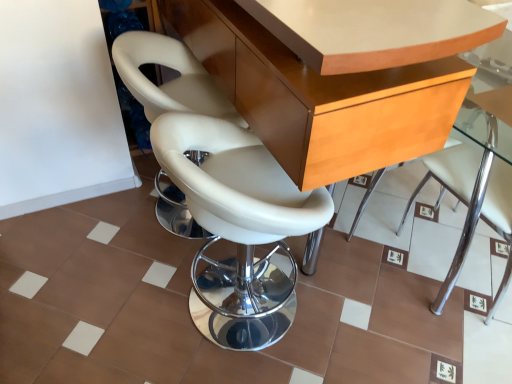
Question: Is white leather chair at center, which ranks as the 3th chair in left-to-right order, not within white leather chair at center, the 2th chair in the left-to-right sequence?

Choices:
 (A) yes
 (B) no

Answer: (A)

Question: From a real-world perspective, is white leather chair at center, which ranks as the 1th chair in right-to-left order, on top of white leather chair at center, the 2th chair in the left-to-right sequence?

Choices:
 (A) no
 (B) yes

Answer: (B)

Question: Does white leather chair at center, which ranks as the 1th chair in right-to-left order, have a lesser width compared to white leather chair at center, the 2th chair in the left-to-right sequence?

Choices:
 (A) yes
 (B) no

Answer: (B)

Question: Considering the relative positions of white leather chair at center, which ranks as the 1th chair in right-to-left order, and white leather chair at center, arranged as the 2th chair when viewed from the right, in the image provided, is white leather chair at center, which ranks as the 1th chair in right-to-left order, to the right of white leather chair at center, arranged as the 2th chair when viewed from the right, from the viewer's perspective?

Choices:
 (A) yes
 (B) no

Answer: (A)

Question: Does white leather chair at center, which ranks as the 3th chair in left-to-right order, have a greater width compared to white leather chair at center, arranged as the 2th chair when viewed from the right?

Choices:
 (A) no
 (B) yes

Answer: (B)

Question: From their relative heights in the image, would you say white leather chair at center, which is counted as the first chair, starting from the left, is taller or shorter than white leather chair at center, which ranks as the 1th chair in right-to-left order?

Choices:
 (A) short
 (B) tall

Answer: (A)

Question: Looking at the image, does white leather chair at center, which is counted as the first chair, starting from the left, seem bigger or smaller compared to white leather chair at center, which ranks as the 3th chair in left-to-right order?

Choices:
 (A) big
 (B) small

Answer: (A)

Question: Does point [x=230, y=114] appear closer or farther from the camera than point [x=440, y=185]?

Choices:
 (A) farther
 (B) closer

Answer: (B)

Question: Is white leather chair at center, which ranks as the 3th chair in right-to-left order, in front of or behind white leather chair at center, which ranks as the 3th chair in left-to-right order, in the image?

Choices:
 (A) front
 (B) behind

Answer: (B)

Question: Considering the positions of white leather chair at center, the 2th chair in the left-to-right sequence, and light brown wood table at center in the image, is white leather chair at center, the 2th chair in the left-to-right sequence, taller or shorter than light brown wood table at center?

Choices:
 (A) tall
 (B) short

Answer: (B)

Question: From a real-world perspective, is white leather chair at center, the 2th chair in the left-to-right sequence, physically located above or below light brown wood table at center?

Choices:
 (A) below
 (B) above

Answer: (A)

Question: Would you say white leather chair at center, arranged as the 2th chair when viewed from the right, is inside or outside light brown wood table at center?

Choices:
 (A) inside
 (B) outside

Answer: (A)

Question: Is point (205, 269) closer or farther from the camera than point (392, 82)?

Choices:
 (A) farther
 (B) closer

Answer: (A)

Question: Is light brown wood table at center situated inside white leather chair at center, which ranks as the 1th chair in right-to-left order, or outside?

Choices:
 (A) inside
 (B) outside

Answer: (B)

Question: Relative to white leather chair at center, which ranks as the 3th chair in left-to-right order, is light brown wood table at center in front or behind?

Choices:
 (A) front
 (B) behind

Answer: (A)